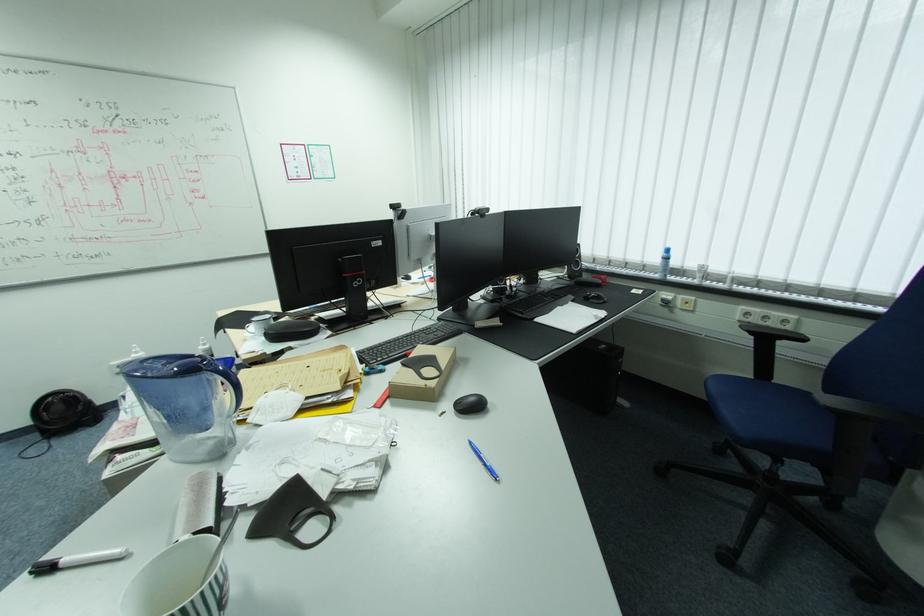
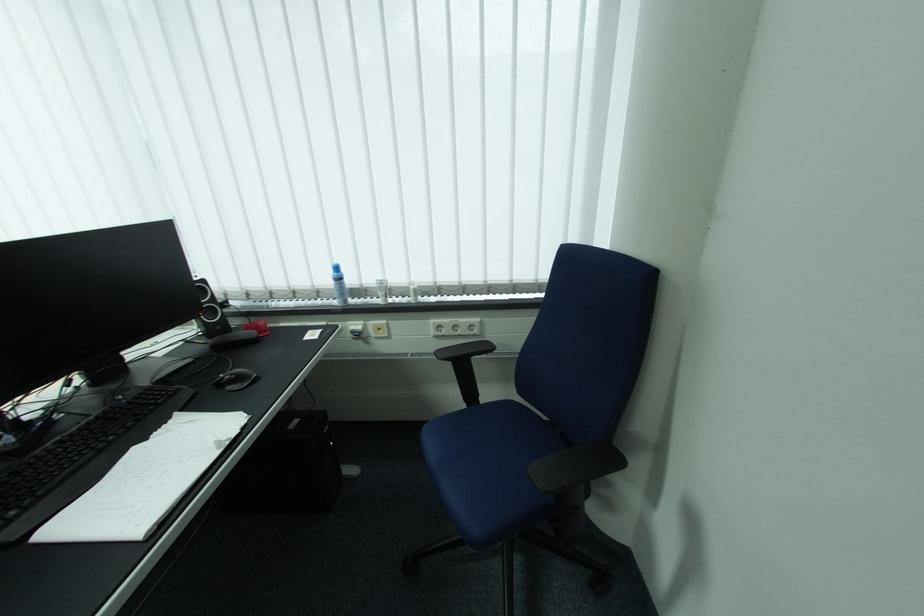
Question: The camera is either moving clockwise (left) or counter-clockwise (right) around the object. The first image is from the beginning of the video and the second image is from the end. Is the camera moving left or right when shooting the video?

Choices:
 (A) Left
 (B) Right

Answer: (A)